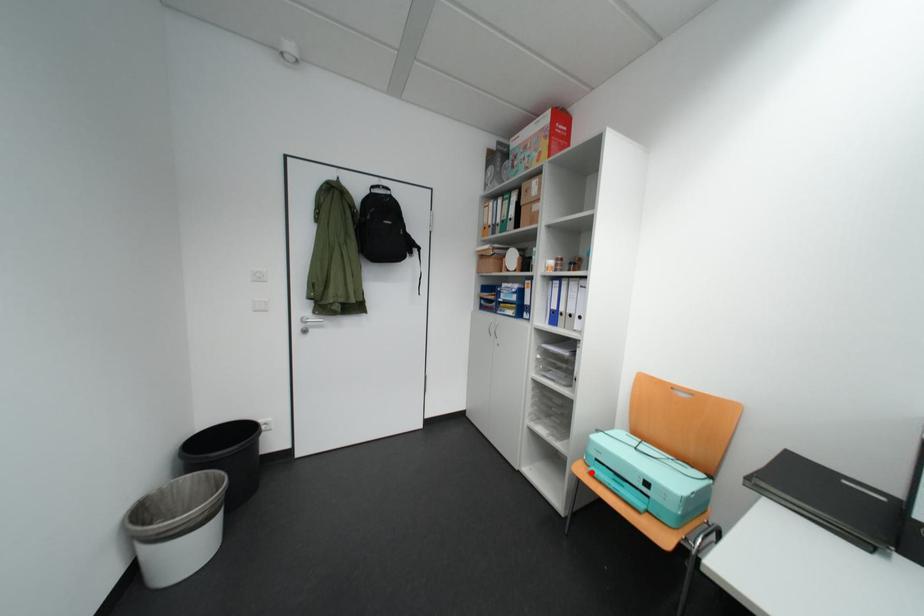
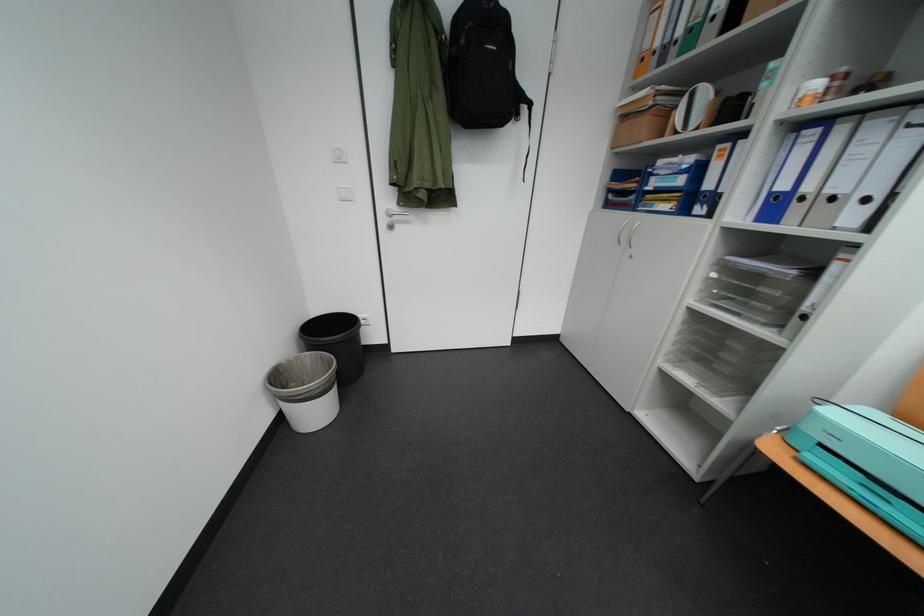
Question: I am providing you with two images of the same scene from different viewpoints. Image1 has a red point marked. In image2, the corresponding 3D location appears at what relative position? Reply with the corresponding letter.

Choices:
 (A) Closer
 (B) Farther

Answer: (B)